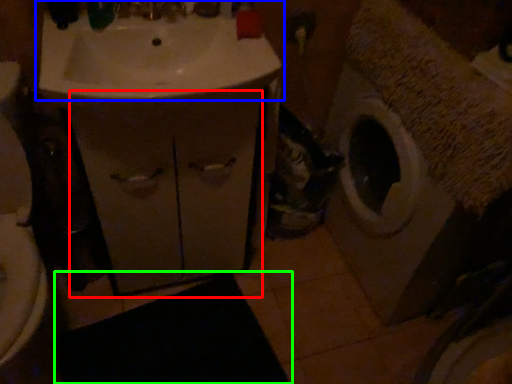
Question: Which object is the closest to the drawer (highlighted by a red box)? Choose among these: sink (highlighted by a blue box) or bath mat (highlighted by a green box).

Choices:
 (A) sink
 (B) bath mat

Answer: (A)